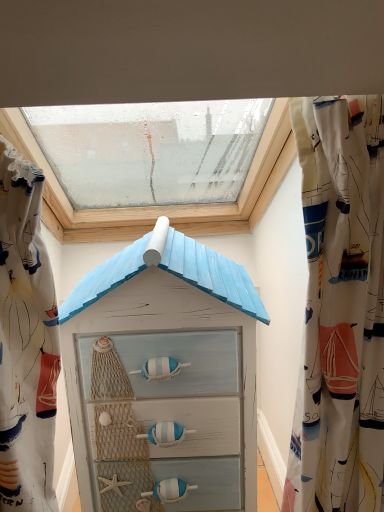
Question: Considering the relative sizes of transparent glass window at upper center and light blue painted wood at center in the image provided, is transparent glass window at upper center wider than light blue painted wood at center?

Choices:
 (A) no
 (B) yes

Answer: (B)

Question: Does transparent glass window at upper center have a larger size compared to light blue painted wood at center?

Choices:
 (A) yes
 (B) no

Answer: (A)

Question: Could you tell me if transparent glass window at upper center is turned towards light blue painted wood at center?

Choices:
 (A) yes
 (B) no

Answer: (B)

Question: Considering the relative sizes of transparent glass window at upper center and light blue painted wood at center in the image provided, is transparent glass window at upper center taller than light blue painted wood at center?

Choices:
 (A) yes
 (B) no

Answer: (B)

Question: Does transparent glass window at upper center have a lesser height compared to light blue painted wood at center?

Choices:
 (A) no
 (B) yes

Answer: (B)

Question: Is transparent glass window at upper center further to the viewer compared to light blue painted wood at center?

Choices:
 (A) yes
 (B) no

Answer: (A)

Question: Could you tell me if light blue painted wood at center is turned towards transparent glass window at upper center?

Choices:
 (A) yes
 (B) no

Answer: (B)

Question: Is light blue painted wood at center at the right side of transparent glass window at upper center?

Choices:
 (A) yes
 (B) no

Answer: (A)

Question: Is the position of light blue painted wood at center less distant than that of transparent glass window at upper center?

Choices:
 (A) no
 (B) yes

Answer: (B)

Question: From the image's perspective, is light blue painted wood at center above transparent glass window at upper center?

Choices:
 (A) yes
 (B) no

Answer: (B)

Question: Would you say light blue painted wood at center is a long distance from transparent glass window at upper center?

Choices:
 (A) yes
 (B) no

Answer: (B)

Question: From a real-world perspective, is light blue painted wood at center beneath transparent glass window at upper center?

Choices:
 (A) yes
 (B) no

Answer: (A)

Question: Is light blue painted wood at center positioned beyond the bounds of white sailboat-patterned fabric at upper left, the 2th curtain when ordered from right to left?

Choices:
 (A) yes
 (B) no

Answer: (A)